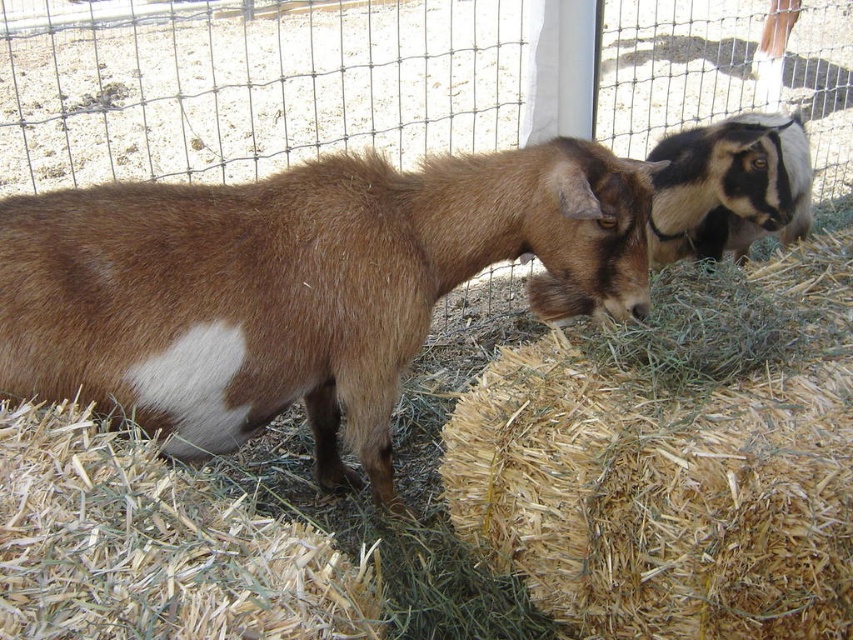
Question: Considering the relative positions of brown straw at lower left and black and white fur goat at upper right in the image provided, where is brown straw at lower left located with respect to black and white fur goat at upper right?

Choices:
 (A) below
 (B) above

Answer: (A)

Question: Is brown straw at lower left to the right of black and white fur goat at upper right from the viewer's perspective?

Choices:
 (A) yes
 (B) no

Answer: (B)

Question: Which is nearer to the brown straw bale at center?

Choices:
 (A) brown straw at lower left
 (B) black and white fur goat at upper right

Answer: (A)

Question: Which point appears farthest from the camera in this image?

Choices:
 (A) (798, 236)
 (B) (65, 545)

Answer: (A)

Question: Is brown straw at lower left positioned behind black and white fur goat at upper right?

Choices:
 (A) no
 (B) yes

Answer: (A)

Question: Which object is farther from the camera taking this photo?

Choices:
 (A) brown fuzzy goat at center
 (B) black and white fur goat at upper right
 (C) brown straw at lower left
 (D) brown straw bale at center

Answer: (B)